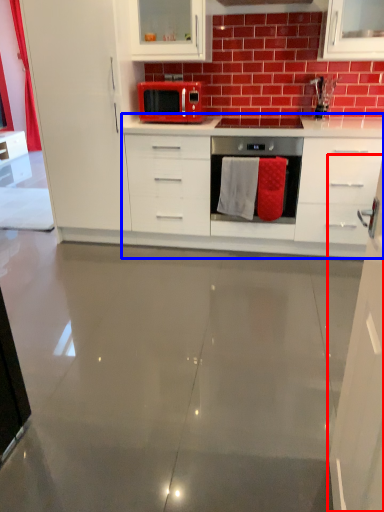
Question: Which object appears farthest to the camera in this image, cabinetry (highlighted by a red box) or countertop (highlighted by a blue box)?

Choices:
 (A) cabinetry
 (B) countertop

Answer: (B)